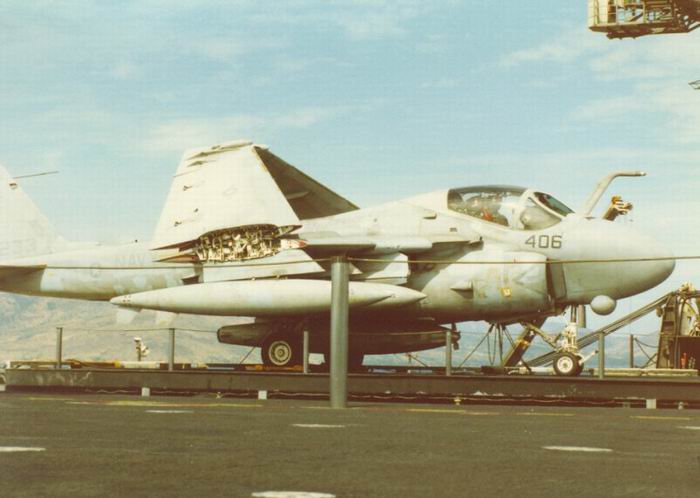
Locate an element on the screen. This screenshot has width=700, height=498. windows is located at coordinates (486, 205), (539, 222), (554, 205).